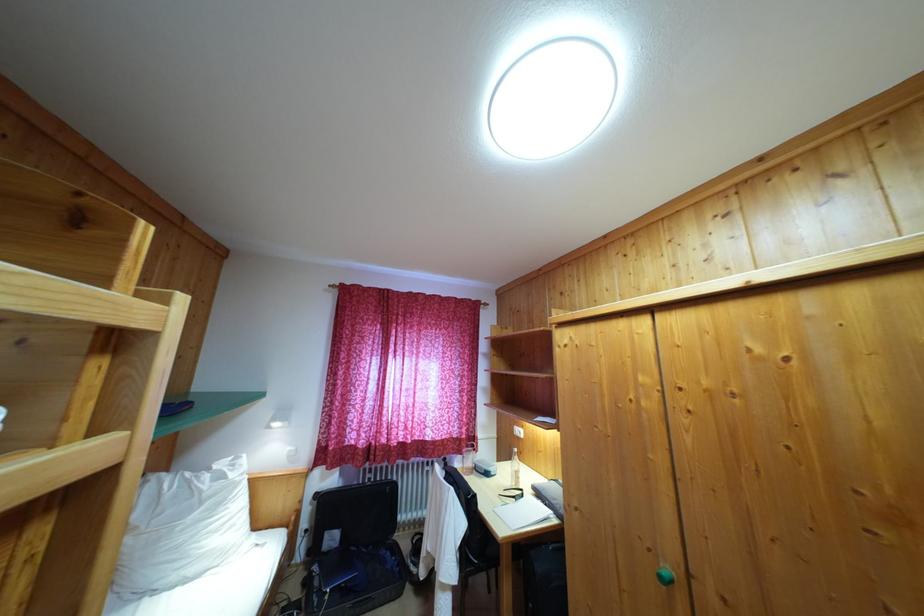
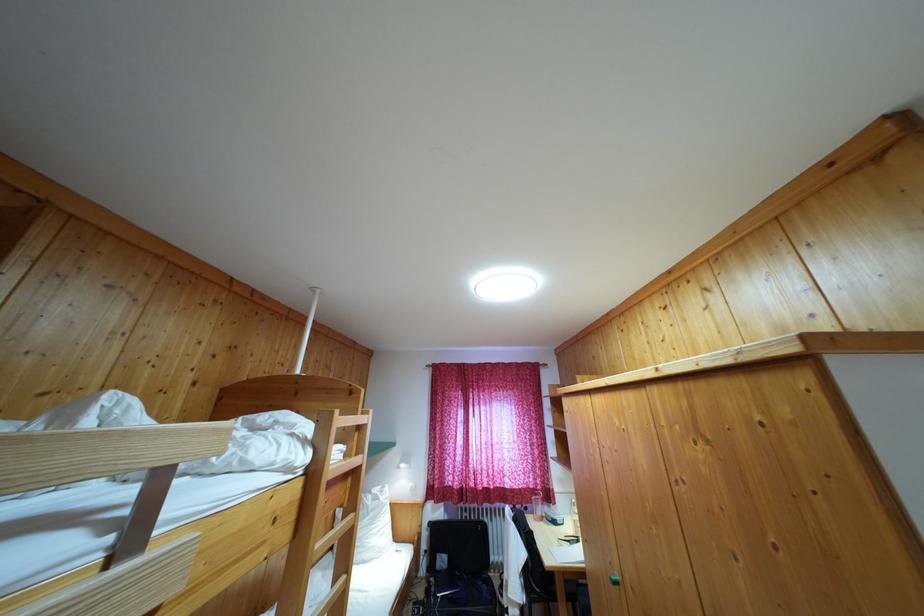
In the second image, find the point that corresponds to (470,453) in the first image.

(539, 501)